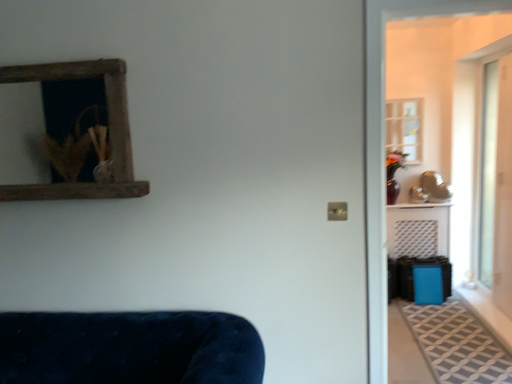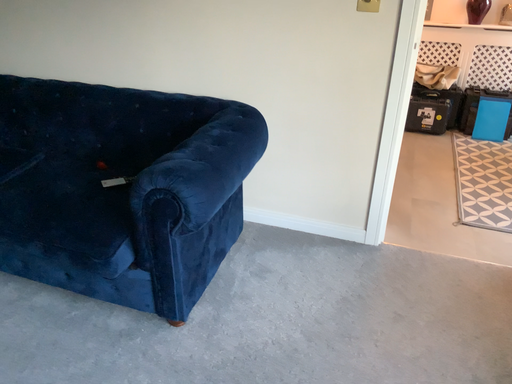
Question: How did the camera likely rotate when shooting the video?

Choices:
 (A) rotated right
 (B) rotated left

Answer: (B)